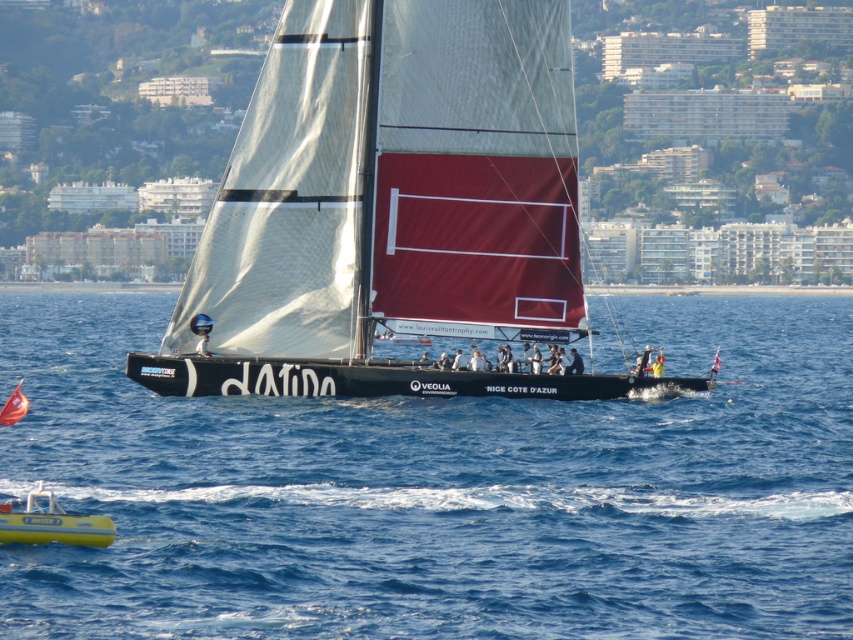
You are a photographer on a boat trying to capture the white matte sail at center and the yellow rubber dinghy at lower left in your shot. Which object will appear larger in the photo?

The white matte sail at center will appear larger in the photo since it has a greater height compared to the yellow rubber dinghy at lower left.

Consider the image. You are a photographer on a boat and want to capture the blue water at center and the yellow rubber dinghy at lower left in a single shot. Which object will occupy more space in your photo?

The blue water at center will occupy more space in the photo because it is bigger than the yellow rubber dinghy at lower left according to the description.